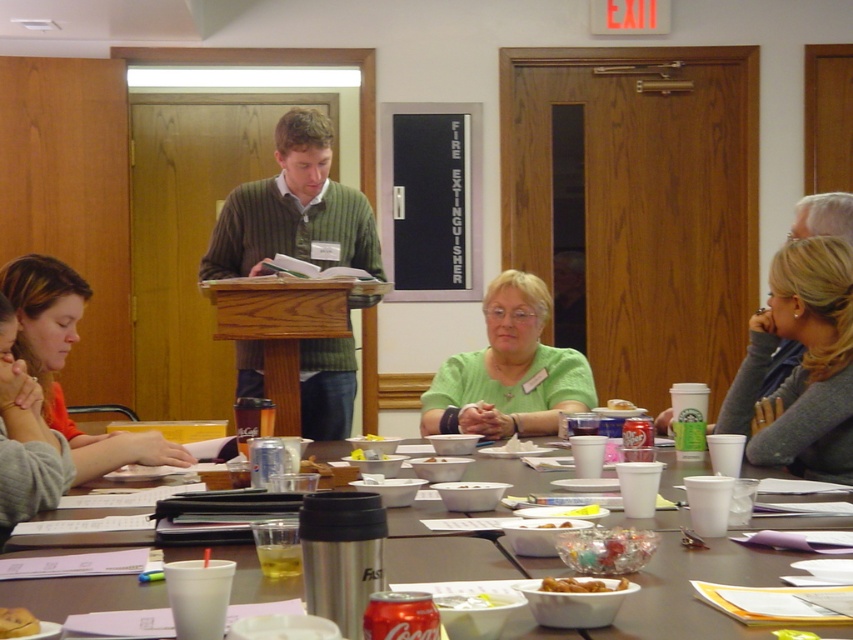
Question: Which of the following is the farthest from the observer?

Choices:
 (A) green knitted sweater at center
 (B) white matte bowl at center

Answer: (A)

Question: Among these points, which one is nearest to the camera?

Choices:
 (A) (606, 584)
 (B) (41, 419)

Answer: (A)

Question: Is white matte bowl at center closer to camera compared to translucent plastic cup at center?

Choices:
 (A) no
 (B) yes

Answer: (B)

Question: Is green knitted sweater at center above translucent glass bowl at center?

Choices:
 (A) yes
 (B) no

Answer: (A)

Question: Based on their relative distances, which object is farther from the golden crispy bread at center?

Choices:
 (A) translucent plastic bowl at center
 (B) matte green shirt at center

Answer: (B)

Question: From the image, what is the correct spatial relationship of blonde hair at upper right in relation to green matte shirt at center?

Choices:
 (A) right
 (B) left

Answer: (A)